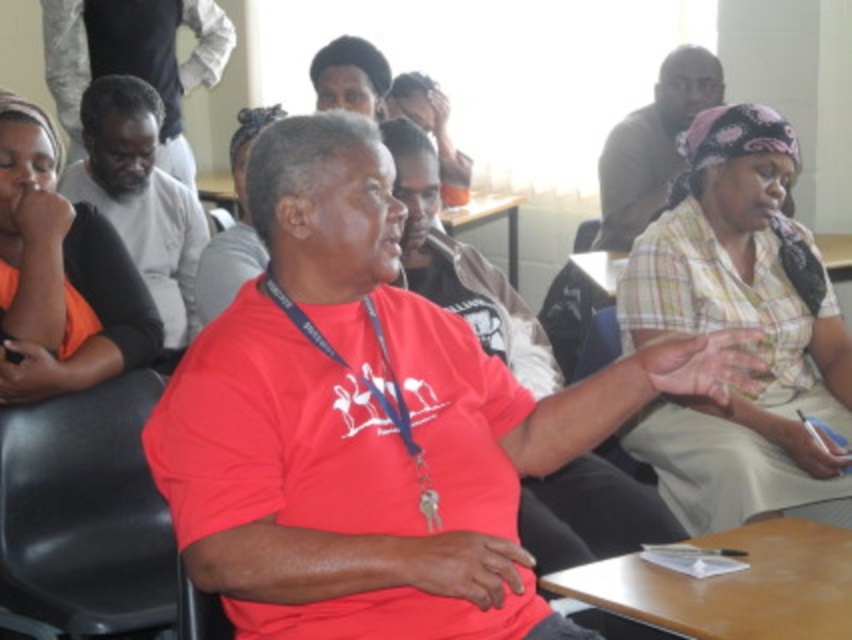
Between black plastic chair at left and matte black shirt at upper right, which one appears on the right side from the viewer's perspective?

matte black shirt at upper right is more to the right.

Based on the photo, which is below, black plastic chair at left or matte black shirt at upper right?

black plastic chair at left is below.

Who is more distant from viewer, (79, 538) or (626, 138)?

Point (626, 138)

Where is `black plastic chair at left`? Image resolution: width=852 pixels, height=640 pixels. black plastic chair at left is located at coordinates (84, 513).

Which of these two, black plastic chair at left or matte black shirt at left, stands taller?

matte black shirt at left

Is black plastic chair at left shorter than matte black shirt at left?

Correct, black plastic chair at left is not as tall as matte black shirt at left.

At what (x,y) coordinates should I click in order to perform the action: click on black plastic chair at left. Please return your answer as a coordinate pair (x, y). This screenshot has height=640, width=852. Looking at the image, I should click on pyautogui.click(x=84, y=513).

You are a GUI agent. You are given a task and a screenshot of the screen. Output one action in this format:
    pyautogui.click(x=<x>, y=<y>)
    Task: Click on the black plastic chair at left
    This screenshot has height=640, width=852.
    Given the screenshot: What is the action you would take?
    pyautogui.click(x=84, y=513)

Does point (717, 97) lie in front of point (513, 244)?

Yes, it is in front of point (513, 244).

Can you confirm if matte black shirt at upper right is positioned above wooden table at center?

Yes.

This screenshot has width=852, height=640. Find the location of `matte black shirt at upper right`. matte black shirt at upper right is located at coordinates (652, 145).

The image size is (852, 640). Find the location of `matte black shirt at upper right`. matte black shirt at upper right is located at coordinates tap(652, 145).